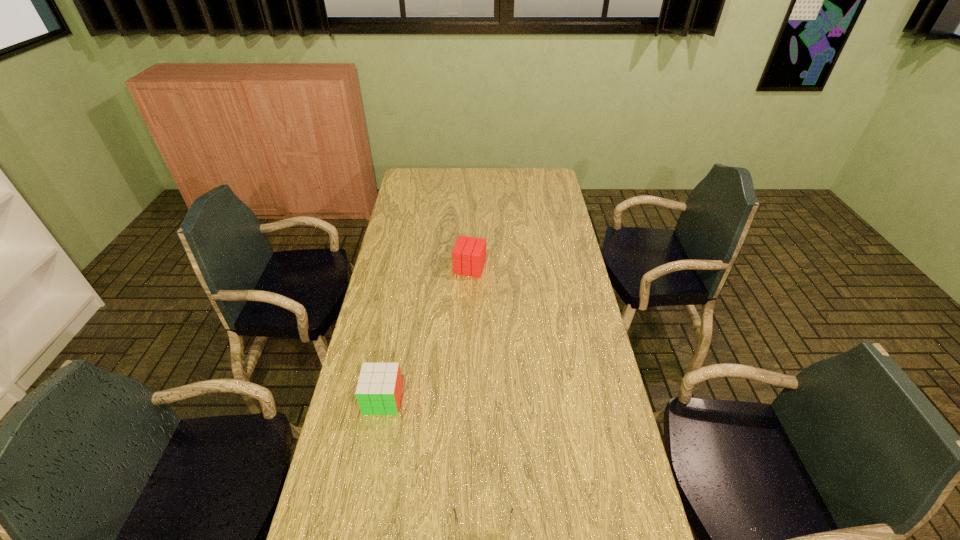
At what (x,y) coordinates should I click in order to perform the action: click on the right cube. Please return your answer as a coordinate pair (x, y). Looking at the image, I should click on (469, 253).

The height and width of the screenshot is (540, 960). Find the location of `the farthest object`. the farthest object is located at coordinates (469, 253).

The width and height of the screenshot is (960, 540). Identify the location of the nearer cube. (379, 388).

At what (x,y) coordinates should I click in order to perform the action: click on the leftmost object. Please return your answer as a coordinate pair (x, y). Looking at the image, I should click on (379, 388).

Image resolution: width=960 pixels, height=540 pixels. What are the coordinates of `free space located 0.050m on the front of the farthest object` in the screenshot? It's located at (469, 287).

Locate an element on the screen. This screenshot has height=540, width=960. vacant space located 0.300m on the front of the second farthest object is located at coordinates (359, 525).

Image resolution: width=960 pixels, height=540 pixels. I want to click on object that is at the left edge, so click(x=379, y=388).

Image resolution: width=960 pixels, height=540 pixels. Identify the location of blank space at the far edge of the desktop. (466, 168).

In the image, there is a desktop. Where is `vacant space at the left edge`? The height and width of the screenshot is (540, 960). vacant space at the left edge is located at coordinates (x=359, y=482).

This screenshot has width=960, height=540. Identify the location of vacant space at the right edge of the desktop. (569, 300).